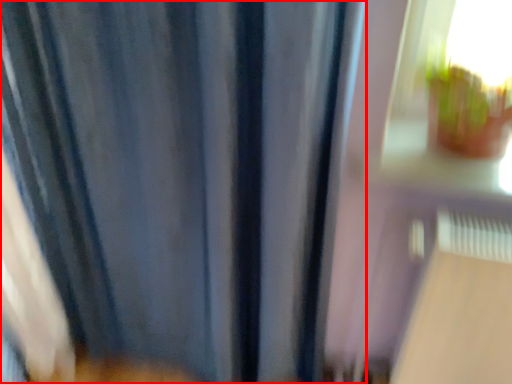
Question: Where is curtain (annotated by the red box) located in relation to train window in the image?

Choices:
 (A) left
 (B) right

Answer: (A)